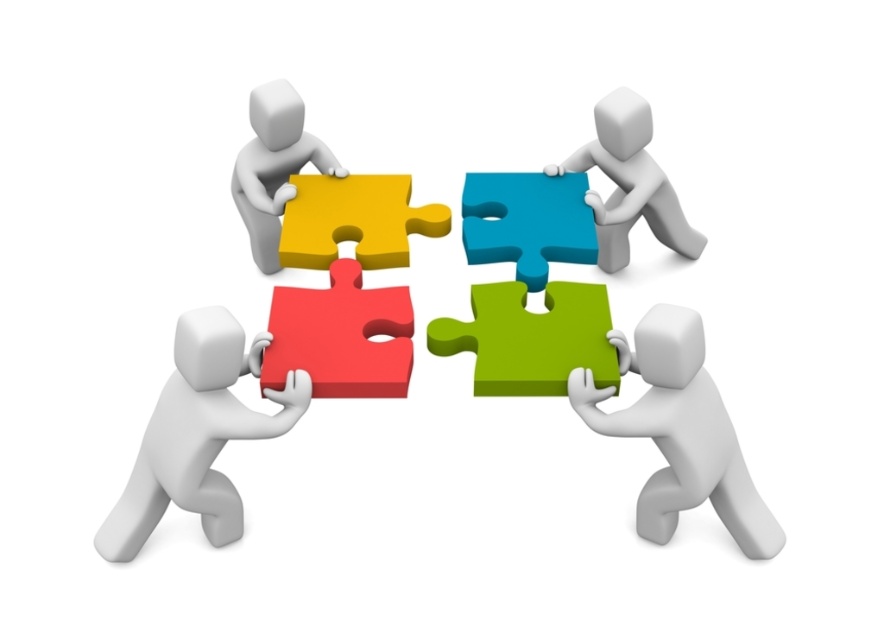
In the scene shown: You are a puzzle assembler working on a collaborative project. You have to place the green matte puzzle piece at lower right and the white matte puzzle piece at upper center into their correct spots. Which puzzle piece should you place first if you want to start with the smaller one?

The green matte puzzle piece at lower right is smaller than the white matte puzzle piece at upper center, so you should place the green matte puzzle piece at lower right first.

You are part of a team working on a puzzle. You see two puzzle pieces in the scene, the green matte puzzle piece at lower right and the matte yellow puzzle piece at upper left. Which one is taller?

The green matte puzzle piece at lower right is much taller than the matte yellow puzzle piece at upper left.